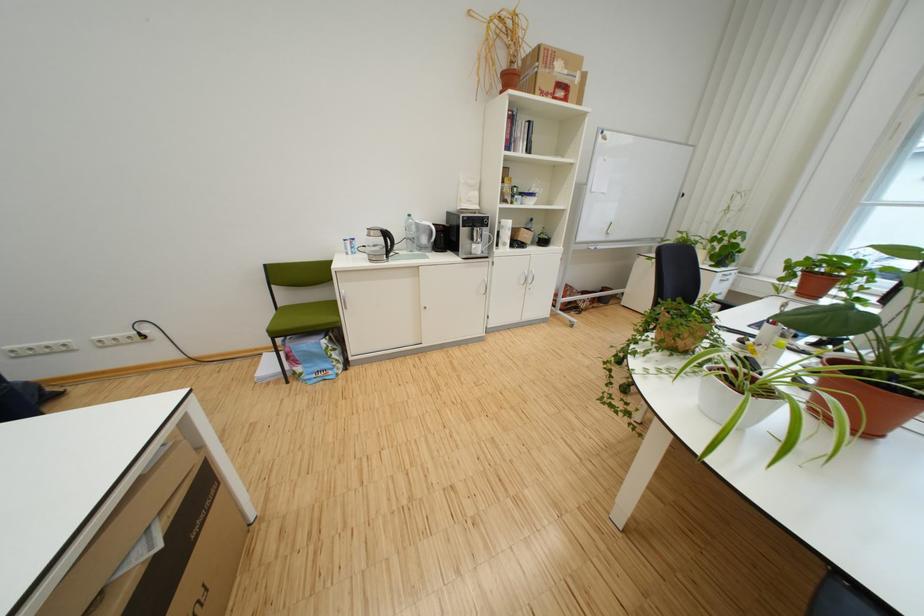
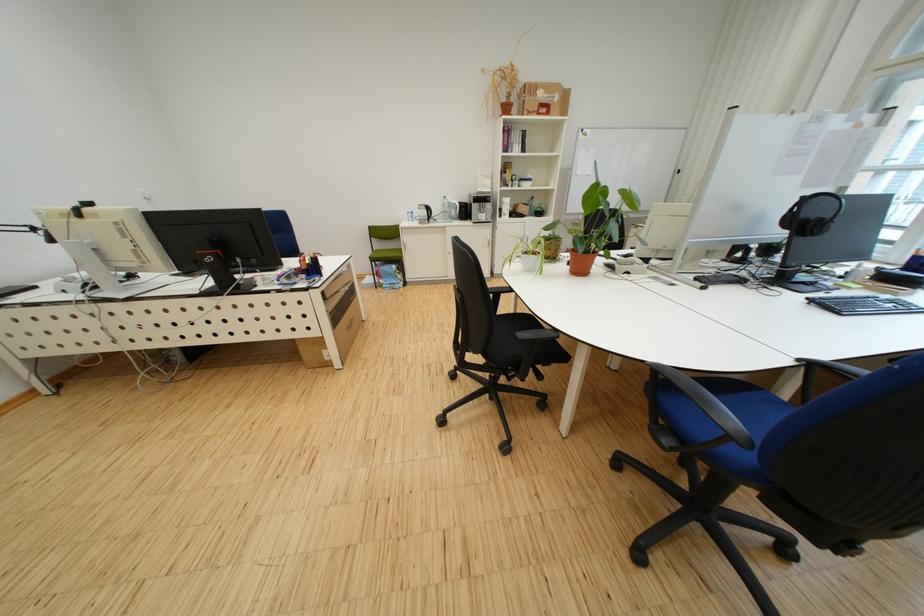
Question: I am providing you with two images of the same scene from different viewpoints. After the viewpoint changes to image2, which objects are now occluded?

Choices:
 (A) cardboard box
 (B) blue chair sitting surface
 (C) white mug
 (D) none of these

Answer: (D)